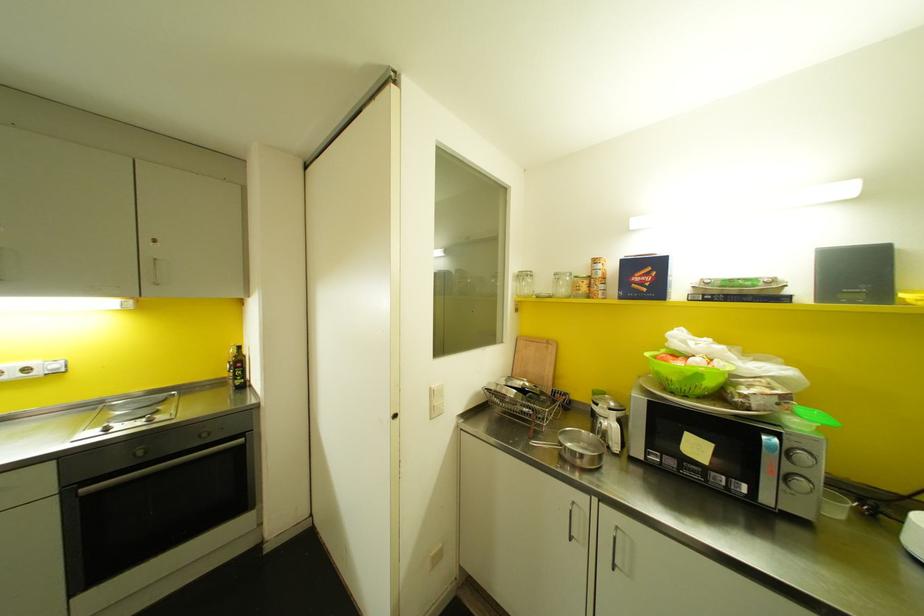
Find where to lift the green plastic colander. Please return your answer as a coordinate pair (x, y).

(687, 373)